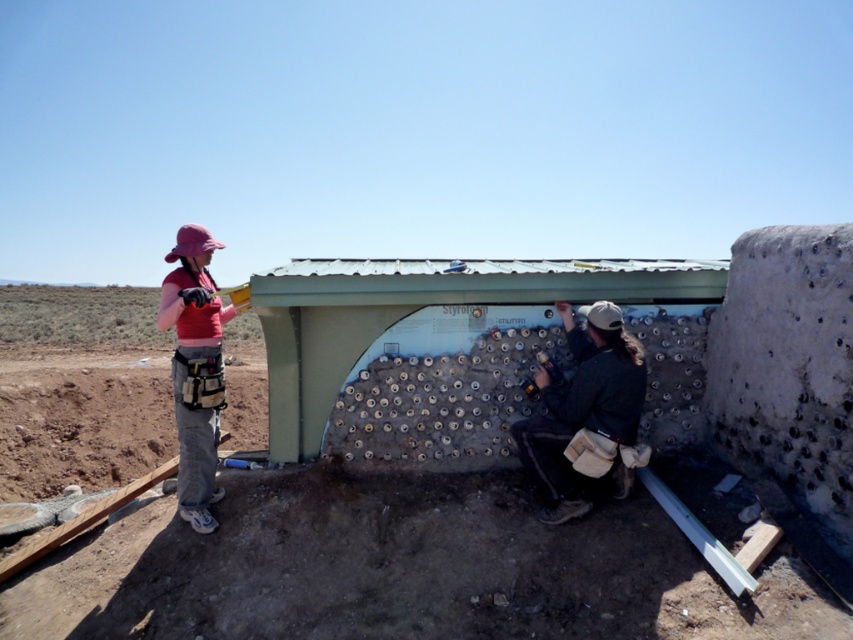
You are standing at the construction site and need to reach the yellow container held by the person on the left. Which of the two points, point (169, 580) or point (535, 440), is closer to the yellow container?

Point (169, 580) is closer to the yellow container because it is in front of point (535, 440).

You are a safety inspector evaluating the construction site. You notice the textured concrete wall at center and the dark green jacket at center. Which object is taller?

The textured concrete wall at center is much taller than the dark green jacket at center.

You are a construction supervisor observing the scene. You need to direct the pink fabric construction worker at left to move closer to the dark green jacket at center. Which direction should they move?

The pink fabric construction worker at left should move to the right to get closer to the dark green jacket at center, as the dark green jacket at center is located to the right of them.